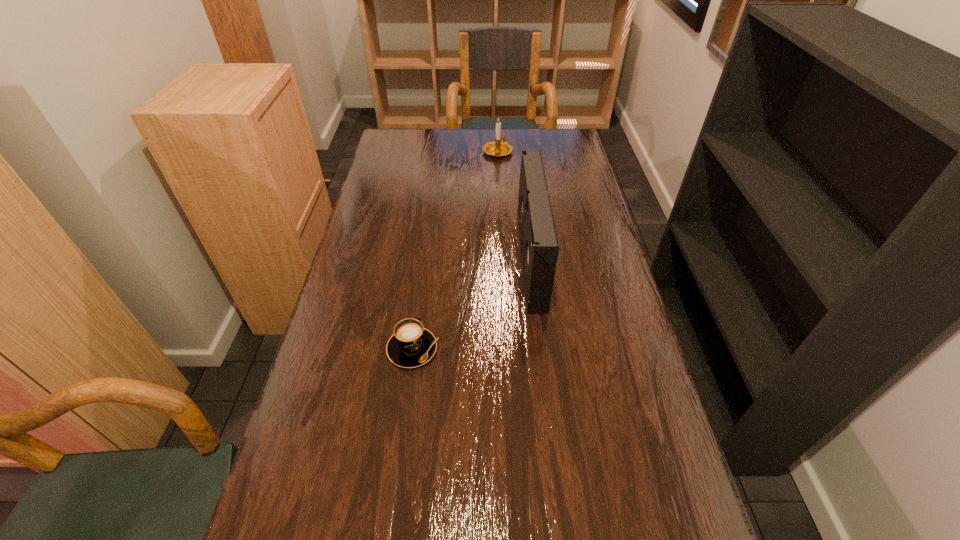
In order to click on free space between the videotape and the nearest object in this screenshot , I will do `click(471, 304)`.

Where is `vacant space that's between the second farthest object and the second tallest object`? vacant space that's between the second farthest object and the second tallest object is located at coordinates (515, 205).

Where is `vacant area that lies between the second shortest object and the leftmost object`? The height and width of the screenshot is (540, 960). vacant area that lies between the second shortest object and the leftmost object is located at coordinates coord(455,250).

You are a GUI agent. You are given a task and a screenshot of the screen. Output one action in this format:
    pyautogui.click(x=<x>, y=<y>)
    Task: Click on the blank region between the videotape and the nearest object
    This screenshot has width=960, height=540.
    Given the screenshot: What is the action you would take?
    pyautogui.click(x=471, y=304)

I want to click on free space between the candle holder and the cappuccino, so click(x=455, y=250).

Point out which object is positioned as the nearest to the cappuccino. Please provide its 2D coordinates. Your answer should be formatted as a tuple, i.e. [(x, y)], where the tuple contains the x and y coordinates of a point satisfying the conditions above.

[(539, 245)]

Locate an element on the screen. object that stands as the second closest to the second tallest object is located at coordinates (411, 345).

Where is `vacant space that satisfies the following two spatial constraints: 1. on the side of the tallest object with visible spindles; 2. on the front side of the shortest object`? The height and width of the screenshot is (540, 960). vacant space that satisfies the following two spatial constraints: 1. on the side of the tallest object with visible spindles; 2. on the front side of the shortest object is located at coordinates (541, 349).